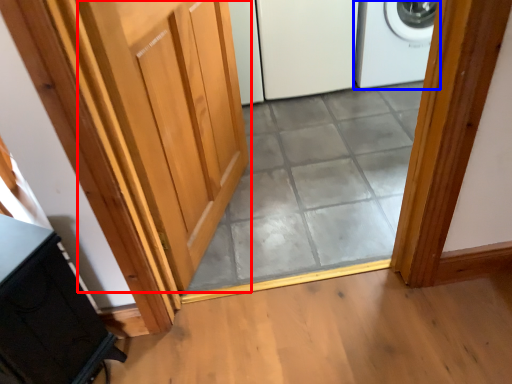
Question: Which of the following is the closest to the observer, door (highlighted by a red box) or home appliance (highlighted by a blue box)?

Choices:
 (A) door
 (B) home appliance

Answer: (A)